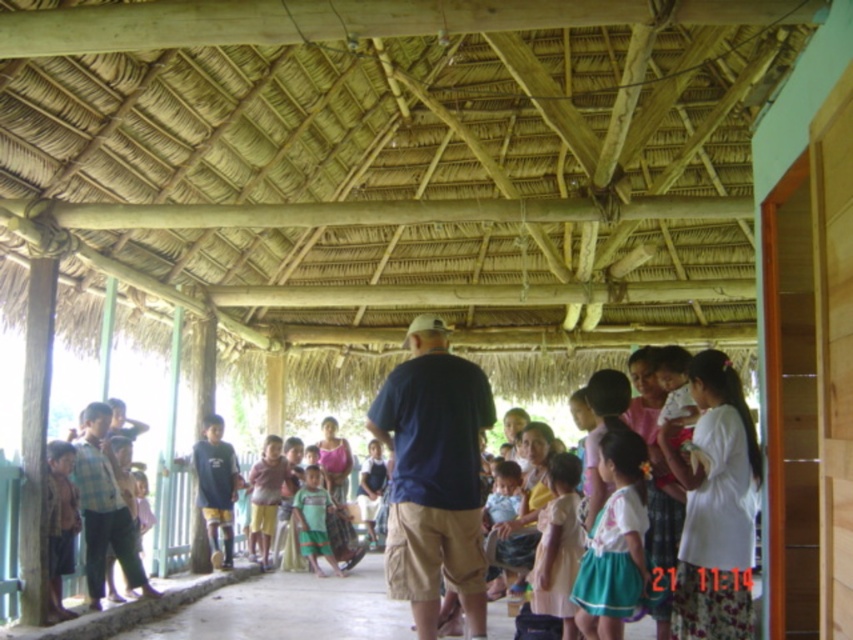
Can you confirm if green cotton shirt at center is bigger than light brown wooden chair at center?

No.

I want to click on green cotton shirt at center, so click(x=312, y=520).

In the scene shown: Who is more forward, [300,540] or [364,504]?

Point [300,540]

The height and width of the screenshot is (640, 853). In order to click on green cotton shirt at center in this screenshot , I will do `click(312, 520)`.

Is white cotton dress at center shorter than light pink fabric dress at center?

Incorrect, white cotton dress at center's height does not fall short of light pink fabric dress at center's.

Is white cotton dress at center taller than light pink fabric dress at center?

Yes, white cotton dress at center is taller than light pink fabric dress at center.

Find the location of a particular element. Image resolution: width=853 pixels, height=640 pixels. white cotton dress at center is located at coordinates (614, 541).

Is dark blue shirt at center taller than light pink fabric dress at center?

Indeed, dark blue shirt at center has a greater height compared to light pink fabric dress at center.

Who is higher up, dark blue shirt at center or light pink fabric dress at center?

dark blue shirt at center is above.

Describe the element at coordinates (434, 476) in the screenshot. I see `dark blue shirt at center` at that location.

Identify the location of dark blue shirt at center. The height and width of the screenshot is (640, 853). (434, 476).